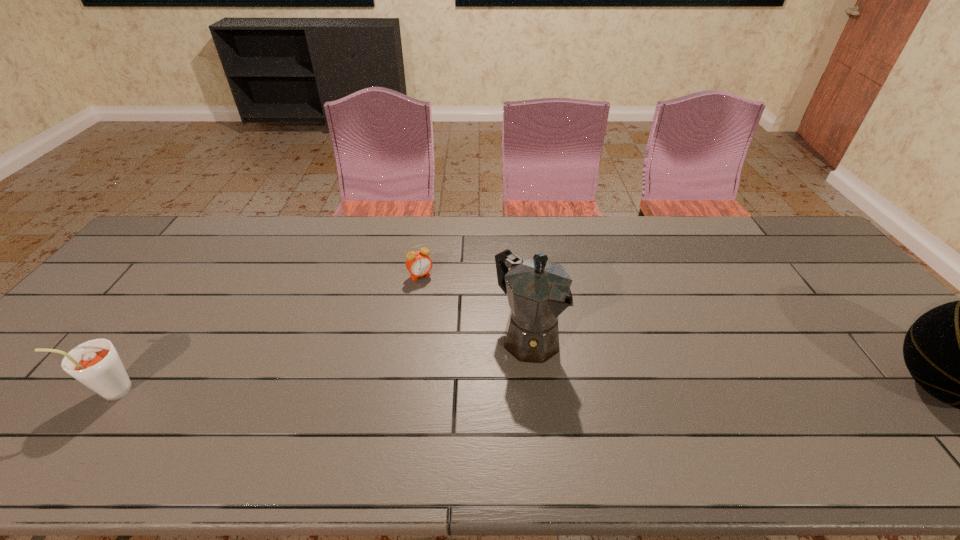
Locate an element on the screen. the leftmost object is located at coordinates point(96,364).

Locate an element on the screen. This screenshot has height=540, width=960. root beer is located at coordinates (96, 364).

Find the location of a particular element. the farthest object is located at coordinates (419, 264).

I want to click on alarm clock, so click(419, 264).

Identify the location of the second object from right to left. The height and width of the screenshot is (540, 960). (538, 290).

Locate an element on the screen. Image resolution: width=960 pixels, height=540 pixels. free space located 0.050m on the drink side of the leftmost object is located at coordinates (65, 390).

Locate an element on the screen. This screenshot has width=960, height=540. free location located on the drink side of the leftmost object is located at coordinates (43, 390).

What are the coordinates of `free space located on the drink side of the leftmost object` in the screenshot? It's located at (18, 390).

At what (x,y) coordinates should I click in order to perform the action: click on vacant space situated on the face of the third object from right to left. Please return your answer as a coordinate pair (x, y). The image size is (960, 540). Looking at the image, I should click on (449, 315).

You are a GUI agent. You are given a task and a screenshot of the screen. Output one action in this format:
    pyautogui.click(x=<x>, y=<y>)
    Task: Click on the free space located on the face of the third object from right to left
    
    Given the screenshot: What is the action you would take?
    pyautogui.click(x=475, y=353)